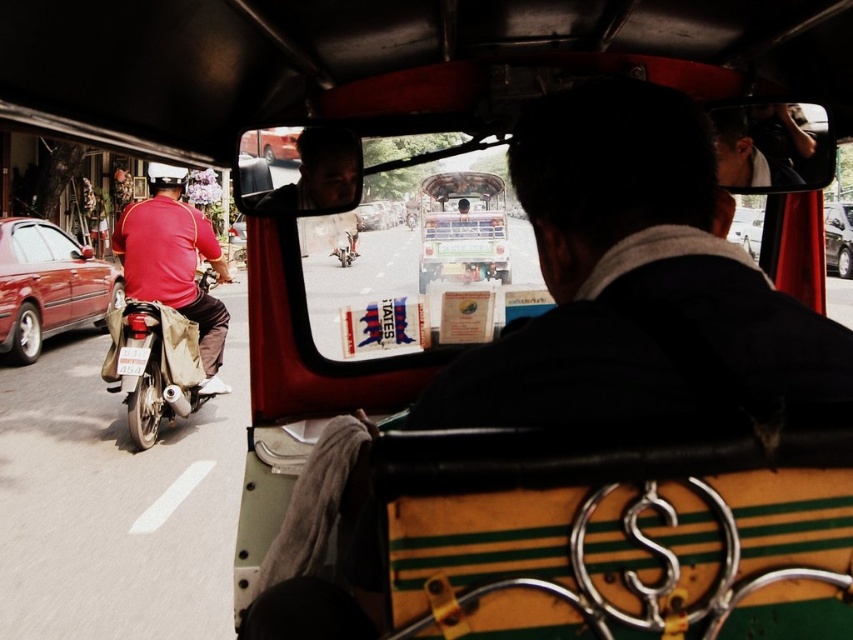
Does point (844, 260) lie in front of point (358, 220)?

No, (844, 260) is behind (358, 220).

Looking at this image, does metallic silver car at right appear on the right side of metallic silver car at center?

Correct, you'll find metallic silver car at right to the right of metallic silver car at center.

Is point (840, 248) farther from camera compared to point (381, 214)?

Yes, point (840, 248) is farther from viewer.

In order to click on metallic silver car at right in this screenshot , I will do `click(838, 237)`.

Identify the location of shiny red car at left. This screenshot has width=853, height=640. (48, 285).

You are a GUI agent. You are given a task and a screenshot of the screen. Output one action in this format:
    pyautogui.click(x=<x>, y=<y>)
    Task: Click on the shiny red car at left
    The width and height of the screenshot is (853, 640).
    Given the screenshot: What is the action you would take?
    pyautogui.click(x=48, y=285)

The image size is (853, 640). Find the location of `shiny red car at left`. shiny red car at left is located at coordinates (48, 285).